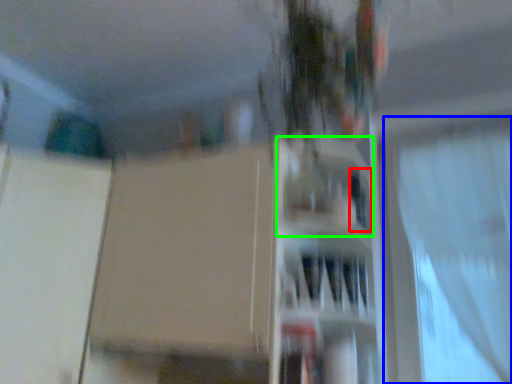
Question: Considering the real-world distances, which object is closest to window (highlighted by a red box)? curtain (highlighted by a blue box) or shelf (highlighted by a green box).

Choices:
 (A) curtain
 (B) shelf

Answer: (B)